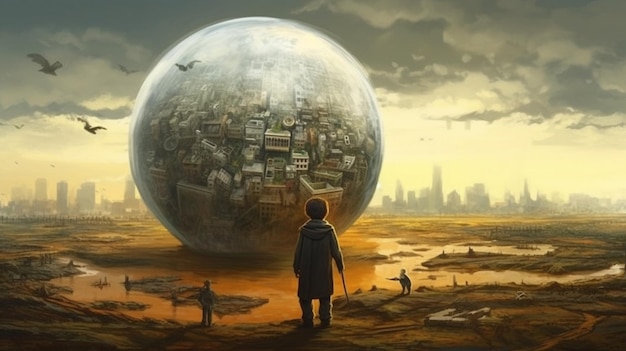
The image size is (626, 351). What are the coordinates of `coat` in the screenshot? It's located at (322, 259).